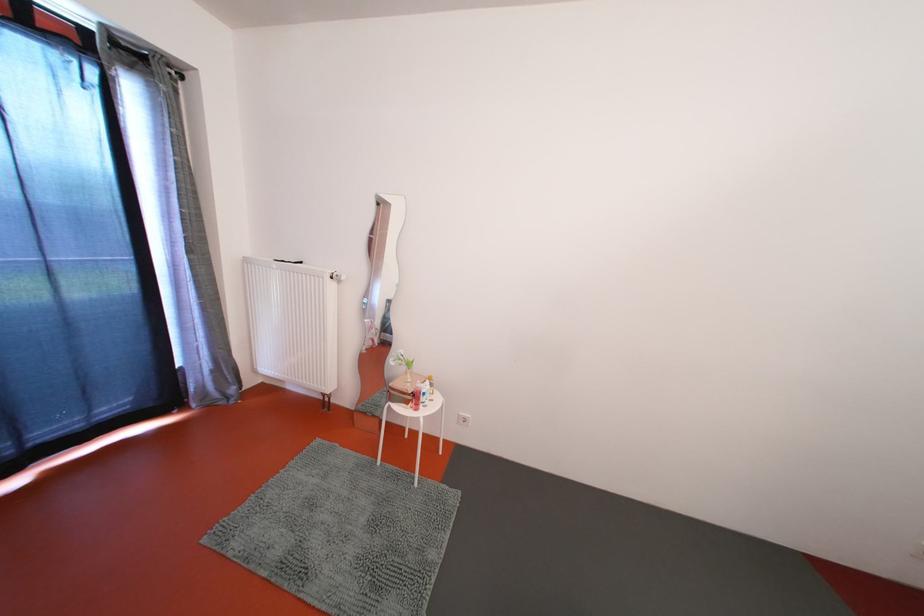
What do you see at coordinates (424, 391) in the screenshot?
I see `the white spray bottle` at bounding box center [424, 391].